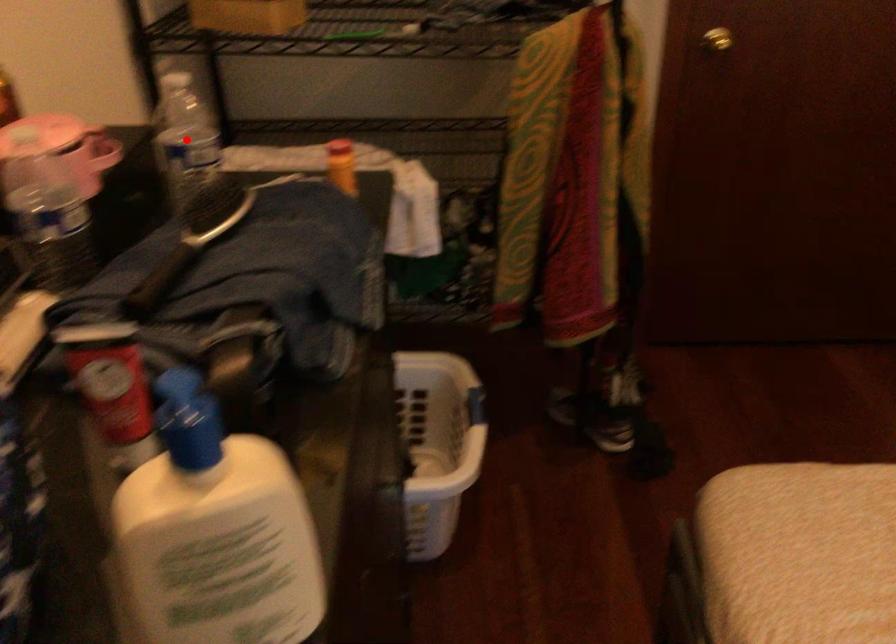
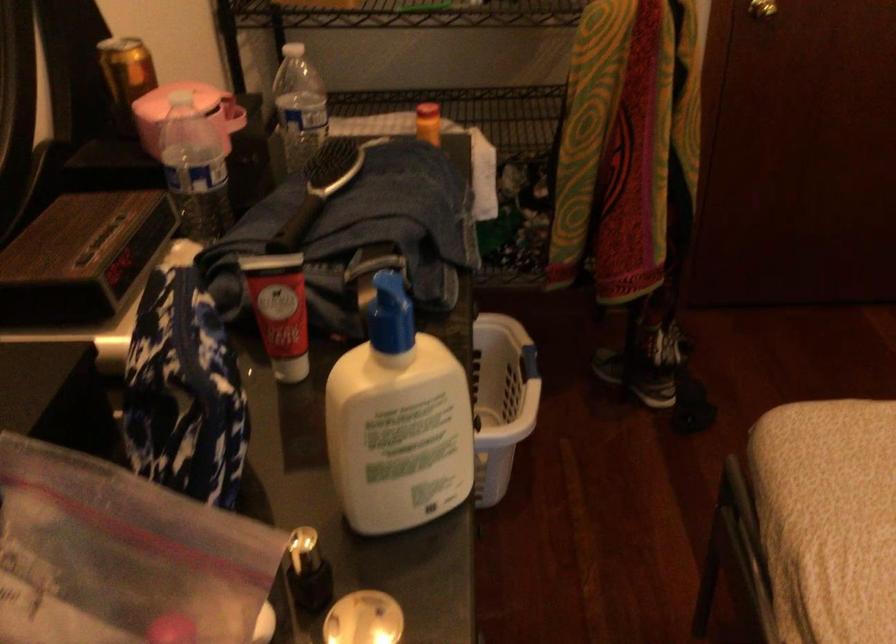
In the second image, find the point that corresponds to the highlighted location in the first image.

(298, 106)